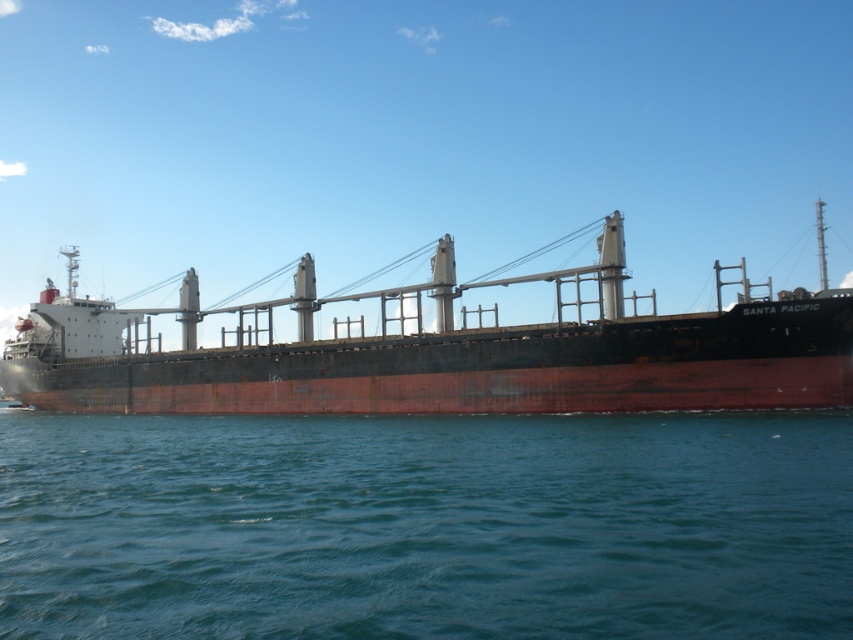
Question: Where is blue water at lower center located in relation to rusty metal ship at center in the image?

Choices:
 (A) below
 (B) above

Answer: (A)

Question: Is blue water at lower center thinner than rusty metal ship at center?

Choices:
 (A) no
 (B) yes

Answer: (B)

Question: Which object appears closest to the camera in this image?

Choices:
 (A) blue water at lower center
 (B) rusty metal ship at center

Answer: (A)

Question: Which point is farther to the camera?

Choices:
 (A) blue water at lower center
 (B) rusty metal ship at center

Answer: (B)

Question: Is blue water at lower center to the right of rusty metal ship at center from the viewer's perspective?

Choices:
 (A) no
 (B) yes

Answer: (A)